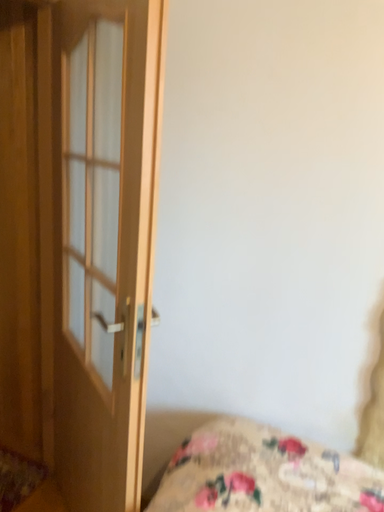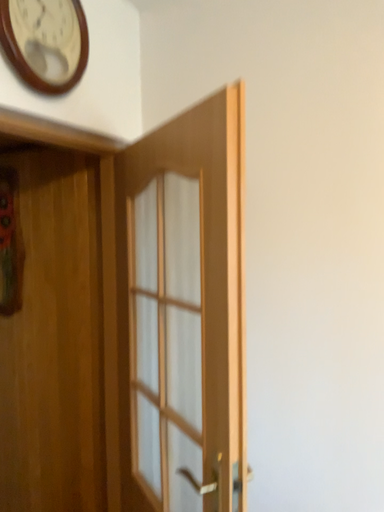
Question: How did the camera likely rotate when shooting the video?

Choices:
 (A) rotated upward
 (B) rotated downward

Answer: (A)